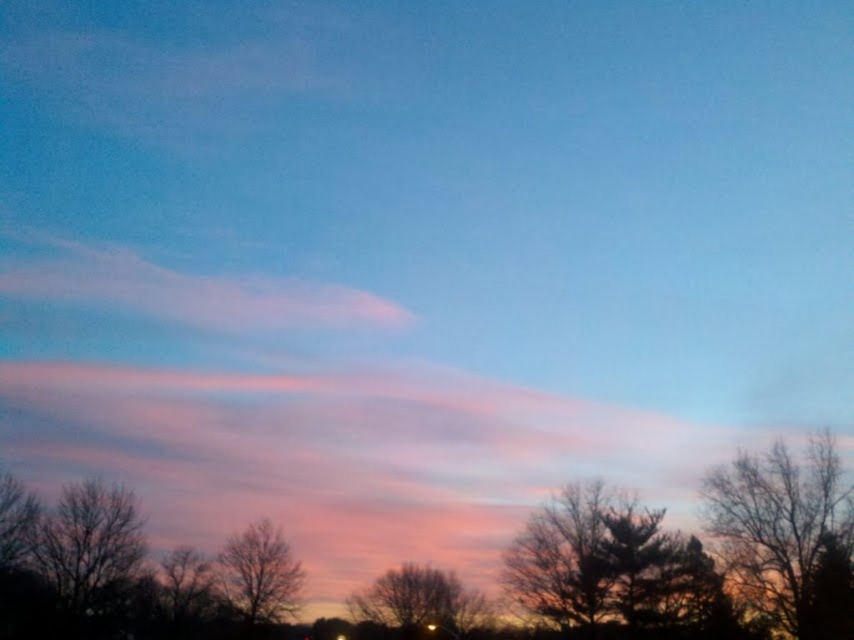
Question: Which object is the farthest from the silhouette bare tree at right?

Choices:
 (A) bare branches at lower center
 (B) pink translucent cloud at upper left
 (C) bare branches at center
 (D) silhouette bare tree at center

Answer: (B)

Question: Which of the following is the farthest from the observer?

Choices:
 (A) silhouette bare tree at center
 (B) pink translucent cloud at upper left

Answer: (B)

Question: Is silhouette bare tree at center further to camera compared to bare branches at center?

Choices:
 (A) yes
 (B) no

Answer: (B)

Question: Is silhouette bare tree at right in front of silhouette bare tree at center?

Choices:
 (A) yes
 (B) no

Answer: (A)

Question: Among these objects, which one is nearest to the camera?

Choices:
 (A) silhouette bare tree at center
 (B) pink translucent cloud at upper left
 (C) bare branches at center
 (D) silhouette bare tree at right

Answer: (D)

Question: Can you confirm if silhouette bare tree at right is positioned below bare branches at center?

Choices:
 (A) no
 (B) yes

Answer: (A)